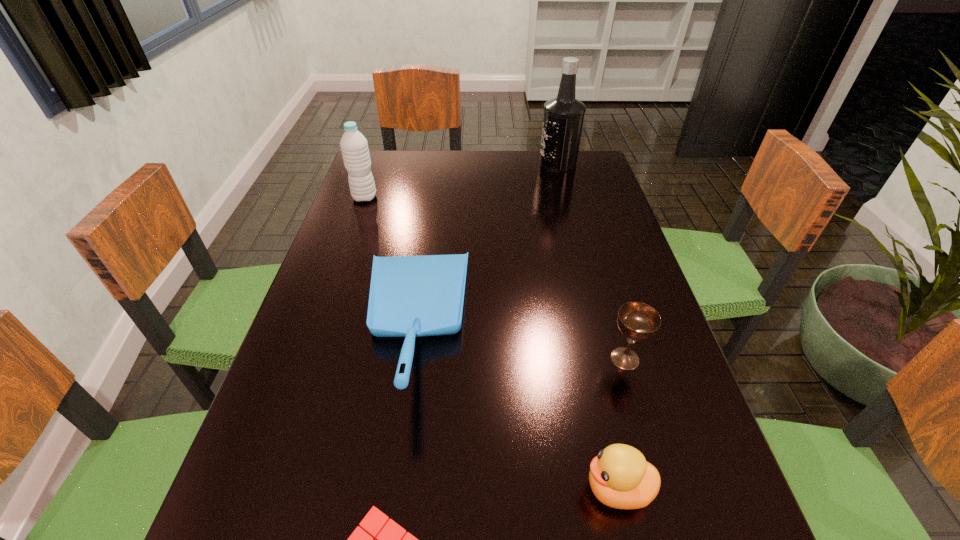
In order to click on free spot located 0.200m on the front label of the farthest object in this screenshot , I will do `click(476, 164)`.

What are the coordinates of `vacant space located on the right of the water bottle` in the screenshot? It's located at (474, 198).

Locate an element on the screen. The height and width of the screenshot is (540, 960). vacant position located 0.230m on the back of the dustpan is located at coordinates (430, 202).

Image resolution: width=960 pixels, height=540 pixels. In order to click on free region located on the back of the chalice in this screenshot , I will do `click(612, 314)`.

Locate an element on the screen. This screenshot has width=960, height=540. free space located on the face of the fifth tallest object is located at coordinates (492, 489).

Where is `free location located 0.050m on the face of the fifth tallest object`? The height and width of the screenshot is (540, 960). free location located 0.050m on the face of the fifth tallest object is located at coordinates (550, 489).

Where is `free space located on the face of the fifth tallest object`? free space located on the face of the fifth tallest object is located at coordinates tap(328, 489).

Image resolution: width=960 pixels, height=540 pixels. Find the location of `object present at the far edge`. object present at the far edge is located at coordinates (563, 118).

At what (x,y) coordinates should I click in order to perform the action: click on water bottle located at the left edge. Please return your answer as a coordinate pair (x, y). Looking at the image, I should click on tap(354, 146).

Where is `dustpan at the left edge`? dustpan at the left edge is located at coordinates (410, 296).